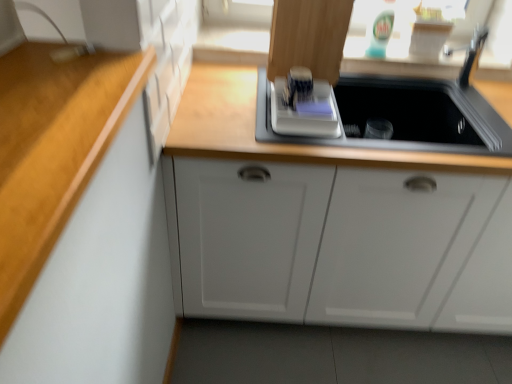
Question: Would you say white plastic cutting board at upper center is part of white matte cabinet at center's contents?

Choices:
 (A) yes
 (B) no

Answer: (B)

Question: Does white matte cabinet at center come in front of white plastic cutting board at upper center?

Choices:
 (A) no
 (B) yes

Answer: (B)

Question: From a real-world perspective, is white matte cabinet at center below white plastic cutting board at upper center?

Choices:
 (A) yes
 (B) no

Answer: (A)

Question: Considering the relative sizes of white matte cabinet at center and white plastic cutting board at upper center in the image provided, is white matte cabinet at center smaller than white plastic cutting board at upper center?

Choices:
 (A) yes
 (B) no

Answer: (B)

Question: Considering the relative sizes of white matte cabinet at center and white plastic cutting board at upper center in the image provided, is white matte cabinet at center taller than white plastic cutting board at upper center?

Choices:
 (A) no
 (B) yes

Answer: (B)

Question: Are white matte cabinet at center and white plastic cutting board at upper center beside each other?

Choices:
 (A) no
 (B) yes

Answer: (A)

Question: From the image's perspective, is white plastic cutting board at upper center on top of white matte cabinet at center?

Choices:
 (A) no
 (B) yes

Answer: (B)

Question: Can you confirm if white plastic cutting board at upper center is thinner than white matte cabinet at center?

Choices:
 (A) yes
 (B) no

Answer: (A)

Question: Is there a large distance between white plastic cutting board at upper center and white matte cabinet at center?

Choices:
 (A) no
 (B) yes

Answer: (A)

Question: From the image's perspective, is white plastic cutting board at upper center under white matte cabinet at center?

Choices:
 (A) yes
 (B) no

Answer: (B)

Question: Can you confirm if white plastic cutting board at upper center is bigger than white matte cabinet at center?

Choices:
 (A) yes
 (B) no

Answer: (B)

Question: Can you confirm if white plastic cutting board at upper center is shorter than white matte cabinet at center?

Choices:
 (A) no
 (B) yes

Answer: (B)

Question: Is white matte cabinet at center bigger or smaller than white plastic cutting board at upper center?

Choices:
 (A) big
 (B) small

Answer: (A)